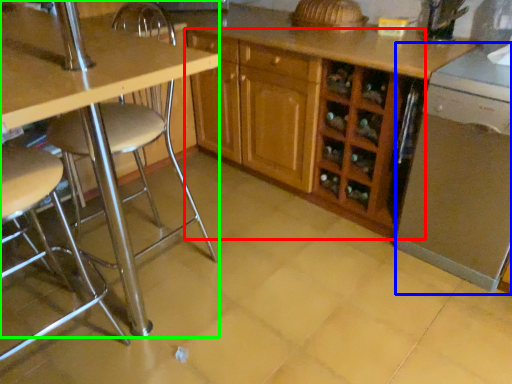
Question: Which object is the farthest from cabinetry (highlighted by a red box)? Choose among these: dish washer (highlighted by a blue box) or table (highlighted by a green box).

Choices:
 (A) dish washer
 (B) table

Answer: (B)